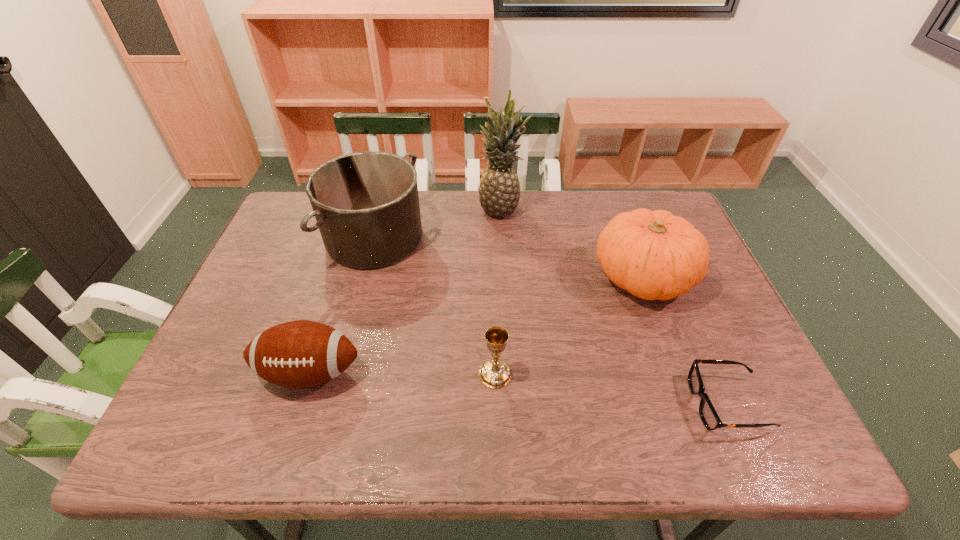
Where is `pineapple`? pineapple is located at coordinates (499, 189).

The image size is (960, 540). What are the coordinates of `pan` in the screenshot? It's located at (366, 204).

Image resolution: width=960 pixels, height=540 pixels. I want to click on pumpkin, so click(x=654, y=255).

At what (x,y) coordinates should I click in order to perform the action: click on football. Please return your answer as a coordinate pair (x, y). The height and width of the screenshot is (540, 960). Looking at the image, I should click on (298, 354).

The height and width of the screenshot is (540, 960). I want to click on chalice, so click(495, 373).

The image size is (960, 540). I want to click on the shortest object, so [711, 420].

At what (x,y) coordinates should I click in order to perform the action: click on vacant region located 0.330m on the front of the tallest object. Please return your answer as a coordinate pair (x, y). This screenshot has width=960, height=540. Looking at the image, I should click on tap(507, 301).

In order to click on vacant area situated 0.340m on the front of the pan in this screenshot , I will do `click(335, 388)`.

Where is `free spot located on the back of the pumpkin`? free spot located on the back of the pumpkin is located at coordinates (619, 214).

The height and width of the screenshot is (540, 960). I want to click on vacant region located 0.070m on the laces of the football, so click(x=291, y=433).